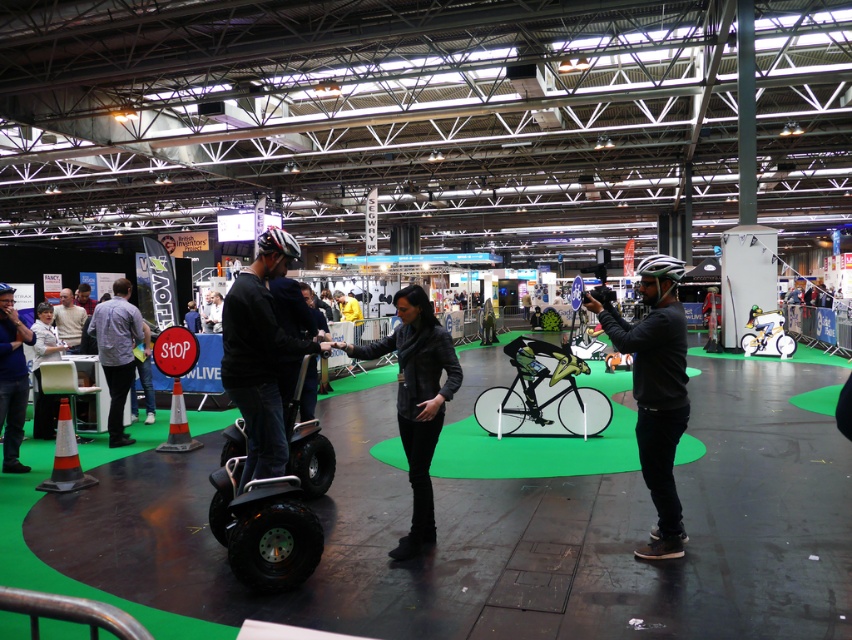
You are planning to set up a booth in the exhibition hall and need to place a 2x3 meter display stand. Considering the black rubber segway at center is currently in the way, where should you position the stand to avoid it?

The black rubber segway at center is located at point [271,504]. To avoid it, position the 2x3 meter display stand in an area not overlapping with these coordinates, such as near the edges or corners of the exhibition hall where there is more space available.

You are a photographer at the event and want to capture both the black leather jacket at center and the white fabric jacket at left in the same frame. Based on their positions, which jacket should you focus on first to ensure both are in the shot?

You should focus on the white fabric jacket at left first because the black leather jacket at center is to the right of it, so by centering the white jacket, the black one will naturally fall into the frame to its right.

You are attending a trade show and notice two jackets displayed on stands. The black leather jacket at center and the white fabric jacket at left. Which jacket is displayed higher up on its stand?

The black leather jacket at center is much taller as white fabric jacket at left, so the black leather jacket at center is displayed higher up on its stand.